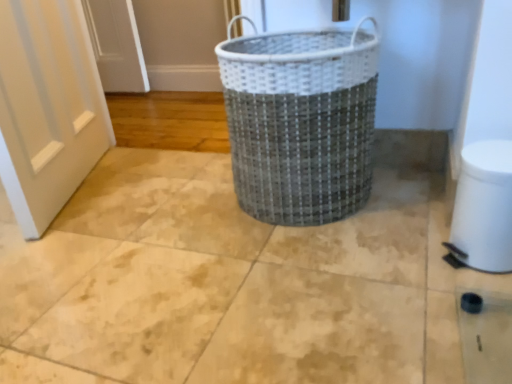
The image size is (512, 384). What do you see at coordinates (483, 208) in the screenshot?
I see `white plastic toilet bowl at lower right` at bounding box center [483, 208].

Identify the location of white plastic toilet bowl at lower right. The height and width of the screenshot is (384, 512). coord(483,208).

You are a GUI agent. You are given a task and a screenshot of the screen. Output one action in this format:
    pyautogui.click(x=<x>, y=<y>)
    Task: Click on the metallic woven basket at center
    The width and height of the screenshot is (512, 384).
    Given the screenshot: What is the action you would take?
    [301, 122]

The image size is (512, 384). What do you see at coordinates (301, 122) in the screenshot?
I see `metallic woven basket at center` at bounding box center [301, 122].

You are a GUI agent. You are given a task and a screenshot of the screen. Output one action in this format:
    pyautogui.click(x=<x>, y=<y>)
    Task: Click on the white plastic toilet bowl at lower right
    The image size is (512, 384).
    Given the screenshot: What is the action you would take?
    pyautogui.click(x=483, y=208)

Considering the relative positions of white plastic toilet bowl at lower right and metallic woven basket at center in the image provided, is white plastic toilet bowl at lower right to the left of metallic woven basket at center from the viewer's perspective?

Incorrect, white plastic toilet bowl at lower right is not on the left side of metallic woven basket at center.

Considering the relative positions of white plastic toilet bowl at lower right and metallic woven basket at center in the image provided, is white plastic toilet bowl at lower right behind metallic woven basket at center?

No, white plastic toilet bowl at lower right is in front of metallic woven basket at center.

Considering the positions of point (501, 198) and point (370, 108), is point (501, 198) closer or farther from the camera than point (370, 108)?

Point (501, 198) is positioned closer to the camera compared to point (370, 108).

From the image's perspective, which is below, white plastic toilet bowl at lower right or metallic woven basket at center?

white plastic toilet bowl at lower right is shown below in the image.

From a real-world perspective, which object rests below the other?

white plastic toilet bowl at lower right, from a real-world perspective.

Which object is wider, white plastic toilet bowl at lower right or metallic woven basket at center?

With larger width is metallic woven basket at center.

Based on the photo, which of these two, white plastic toilet bowl at lower right or metallic woven basket at center, stands taller?

Standing taller between the two is metallic woven basket at center.

Does white plastic toilet bowl at lower right have a smaller size compared to metallic woven basket at center?

Yes.

Can we say white plastic toilet bowl at lower right lies outside metallic woven basket at center?

white plastic toilet bowl at lower right lies outside metallic woven basket at center's area.

Is there a large distance between white plastic toilet bowl at lower right and metallic woven basket at center?

white plastic toilet bowl at lower right is near metallic woven basket at center, not far away.

Is white plastic toilet bowl at lower right oriented towards metallic woven basket at center?

No.

Where is `toilet bowl in front of the metallic woven basket at center`? This screenshot has height=384, width=512. toilet bowl in front of the metallic woven basket at center is located at coordinates (483, 208).

Is metallic woven basket at center to the left of white plastic toilet bowl at lower right from the viewer's perspective?

Yes, metallic woven basket at center is to the left of white plastic toilet bowl at lower right.

Does metallic woven basket at center come in front of white plastic toilet bowl at lower right?

No, metallic woven basket at center is further to the viewer.

Is point (241, 43) closer or farther from the camera than point (466, 260)?

Point (241, 43).

From the image's perspective, who appears lower, metallic woven basket at center or white plastic toilet bowl at lower right?

white plastic toilet bowl at lower right appears lower in the image.

Based on the photo, from a real-world perspective, is metallic woven basket at center above or below white plastic toilet bowl at lower right?

metallic woven basket at center is situated higher than white plastic toilet bowl at lower right in the real world.

Which of these two, metallic woven basket at center or white plastic toilet bowl at lower right, is wider?

metallic woven basket at center is wider.

Is metallic woven basket at center shorter than white plastic toilet bowl at lower right?

No, metallic woven basket at center is not shorter than white plastic toilet bowl at lower right.

Between metallic woven basket at center and white plastic toilet bowl at lower right, which one has smaller size?

white plastic toilet bowl at lower right.

Is white plastic toilet bowl at lower right inside metallic woven basket at center?

No, white plastic toilet bowl at lower right is not surrounded by metallic woven basket at center.

Is metallic woven basket at center touching white plastic toilet bowl at lower right?

They are not placed beside each other.

Is metallic woven basket at center oriented towards white plastic toilet bowl at lower right?

No, metallic woven basket at center is not turned towards white plastic toilet bowl at lower right.

Identify the location of waste container on the left side of white plastic toilet bowl at lower right. (301, 122).

There is a white plastic toilet bowl at lower right. Where is `waste container above it (from a real-world perspective)`? This screenshot has height=384, width=512. waste container above it (from a real-world perspective) is located at coordinates (301, 122).

Identify the location of toilet bowl located on the right of metallic woven basket at center. (483, 208).